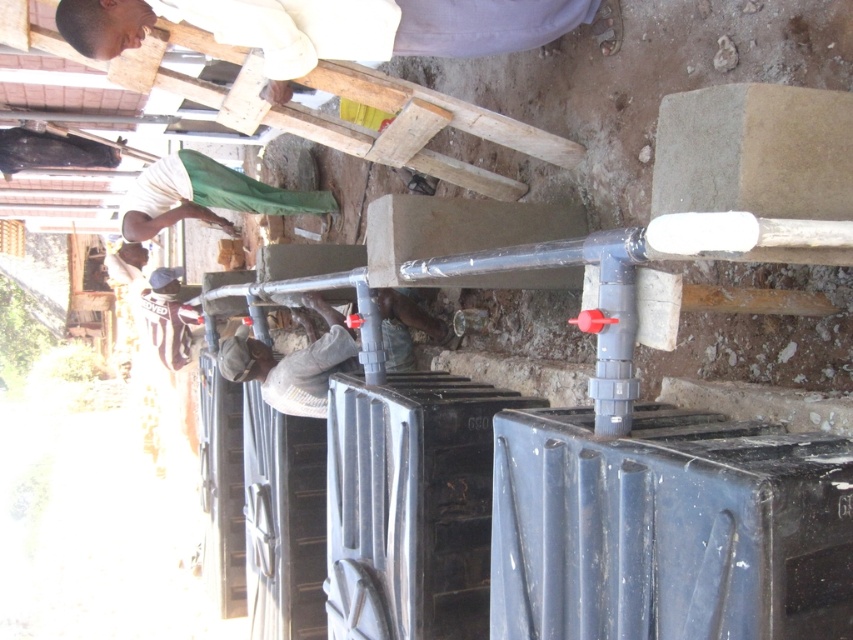
Which is below, dark gray concrete man at center or white matte shirt at upper left?

dark gray concrete man at center is below.

Between point (277, 300) and point (234, 188), which one is positioned behind?

The point (234, 188) is more distant.

This screenshot has height=640, width=853. I want to click on dark gray concrete man at center, so click(x=292, y=362).

Can you confirm if light brown wooden plank at upper center is shorter than white matte shirt at upper left?

Correct, light brown wooden plank at upper center is not as tall as white matte shirt at upper left.

Which is above, light brown wooden plank at upper center or white matte shirt at upper left?

Positioned higher is light brown wooden plank at upper center.

Is point (86, 22) positioned before point (247, 196)?

That is True.

Identify the location of light brown wooden plank at upper center. (379, 28).

Is point (293, 1) farther from viewer compared to point (386, 308)?

No, it is not.

From the picture: Measure the distance from light brown wooden plank at upper center to dark gray concrete man at center.

The distance of light brown wooden plank at upper center from dark gray concrete man at center is 1.11 meters.

Does point (322, 12) come farther from viewer compared to point (227, 344)?

No, (322, 12) is in front of (227, 344).

Identify the location of light brown wooden plank at upper center. This screenshot has width=853, height=640. (379, 28).